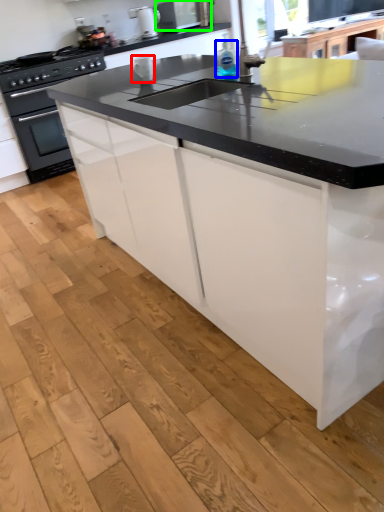
Question: Which object is the farthest from appliance (highlighted by a red box)? Choose among these: bottle (highlighted by a blue box) or kitchen appliance (highlighted by a green box).

Choices:
 (A) bottle
 (B) kitchen appliance

Answer: (B)